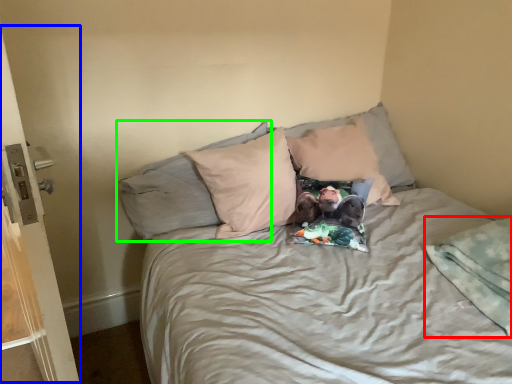
Question: Estimate the real-world distances between objects in this image. Which object is farther from blanket (highlighted by a red box), screen door (highlighted by a blue box) or pillow (highlighted by a green box)?

Choices:
 (A) screen door
 (B) pillow

Answer: (A)